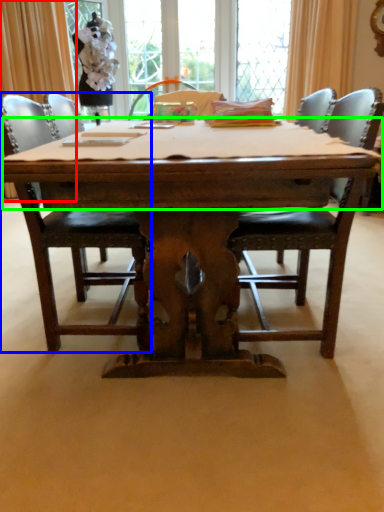
Question: Which object is the farthest from curtain (highlighted by a red box)? Choose among these: chair (highlighted by a blue box) or table top (highlighted by a green box).

Choices:
 (A) chair
 (B) table top

Answer: (B)